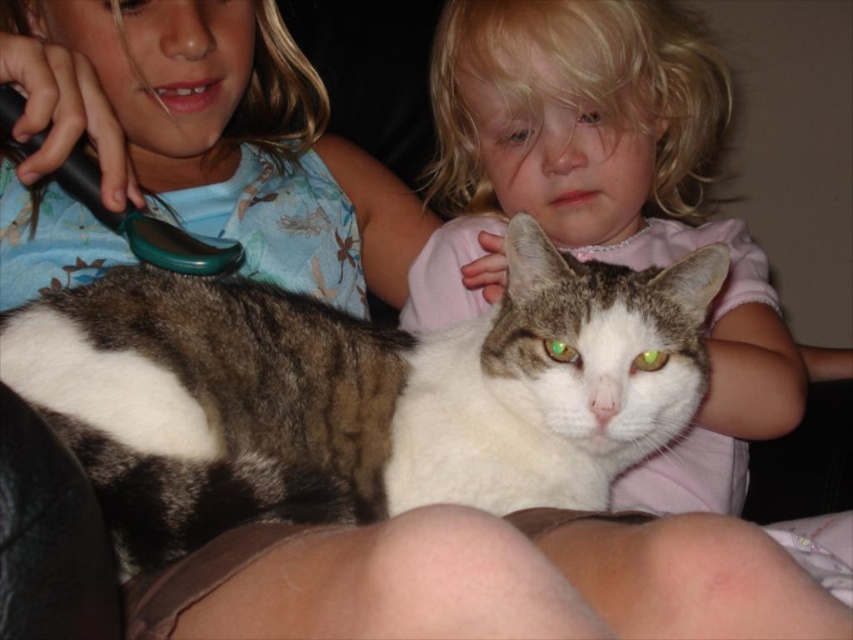
In the scene, there are a tabby fur cat at center and a soft pink shirt at center. Which object is positioned to the left?

The tabby fur cat at center is to the left of the soft pink shirt at center.

You are a photographer trying to capture a photo of the tabby fur cat at center and the soft pink shirt at center. Which object should you focus on first if you want to take a photo where both are in focus?

The tabby fur cat at center is smaller than the soft pink shirt at center, so you should focus on the tabby fur cat at center first to ensure both are in focus.